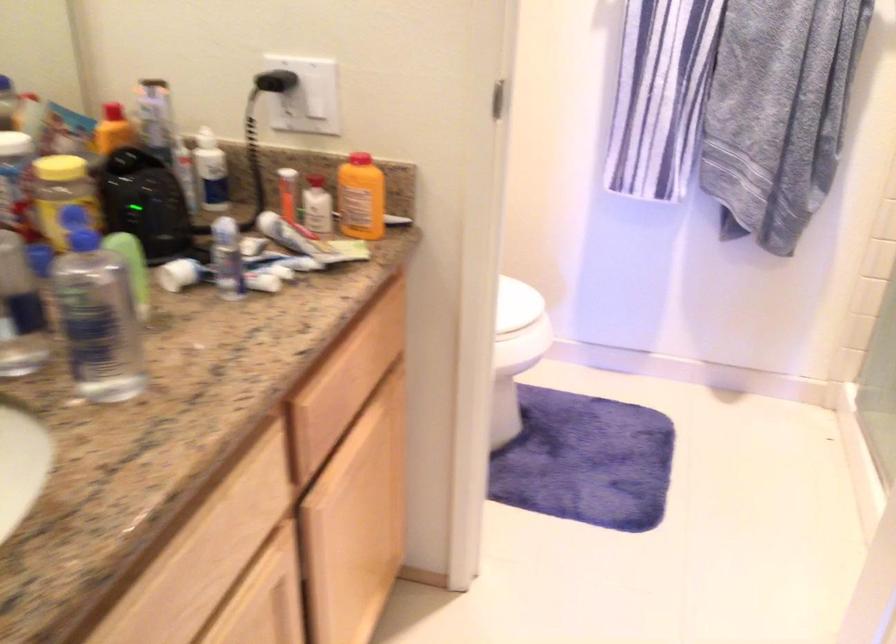
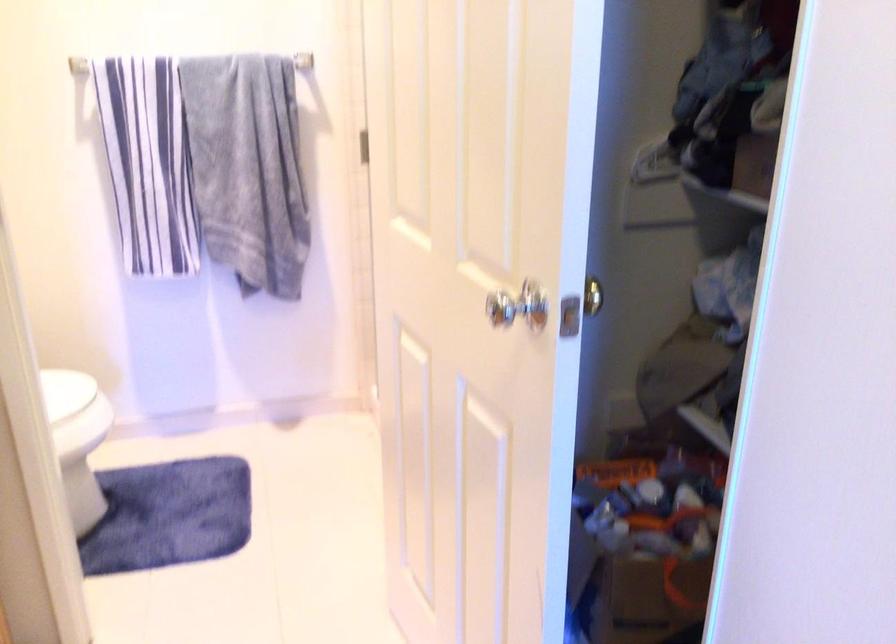
Locate, in the second image, the point that corresponds to (x=514, y=315) in the first image.

(72, 400)